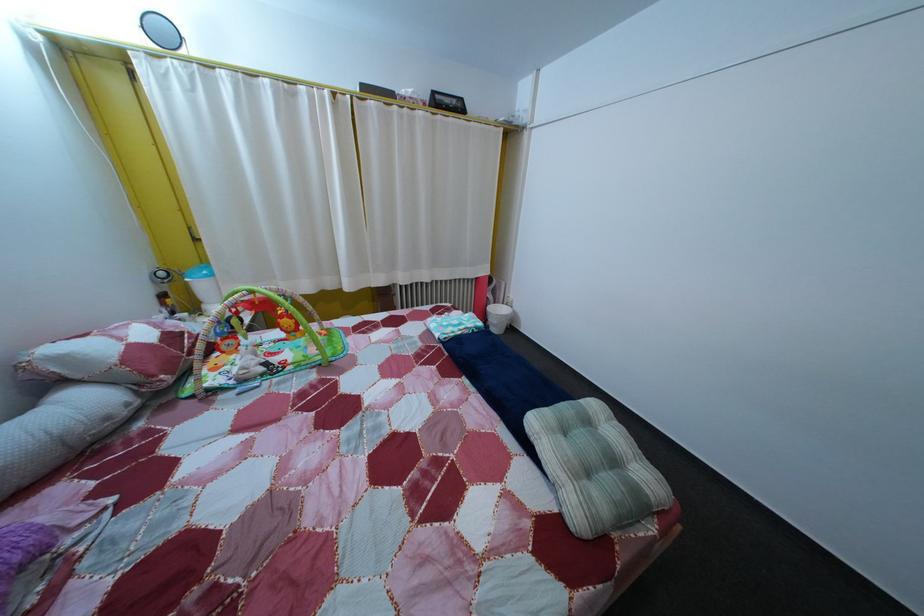
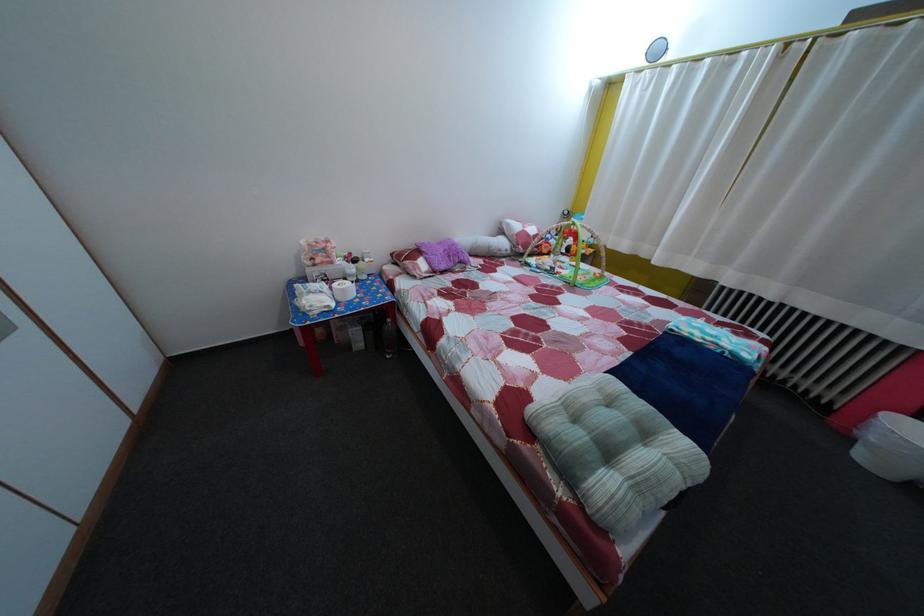
Locate, in the second image, the point that corresponds to (x=502, y=432) in the first image.

(601, 379)